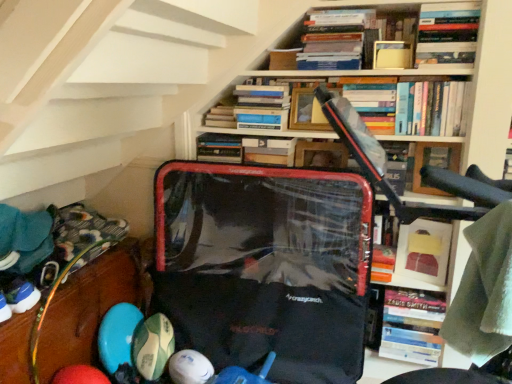
Question: Considering the relative sizes of hardcover book at center, which is the 1th book from bottom to top, and white rubber ball at lower center, positioned as the 1th toy in right-to-left order, in the image provided, is hardcover book at center, which is the 1th book from bottom to top, smaller than white rubber ball at lower center, positioned as the 1th toy in right-to-left order,?

Choices:
 (A) no
 (B) yes

Answer: (A)

Question: Are hardcover book at center, which is the 1th book from bottom to top, and white rubber ball at lower center, which is the second toy in left-to-right order, far apart?

Choices:
 (A) no
 (B) yes

Answer: (A)

Question: Is hardcover book at center, which is the seventh book in top-to-bottom order, to the left of white rubber ball at lower center, positioned as the 1th toy in right-to-left order, from the viewer's perspective?

Choices:
 (A) no
 (B) yes

Answer: (A)

Question: From the image's perspective, is hardcover book at center, which is the seventh book in top-to-bottom order, on white rubber ball at lower center, which is the second toy in left-to-right order?

Choices:
 (A) yes
 (B) no

Answer: (A)

Question: Is white rubber ball at lower center, which is the second toy in left-to-right order, inside hardcover book at center, which is the seventh book in top-to-bottom order?

Choices:
 (A) no
 (B) yes

Answer: (A)

Question: From a real-world perspective, is hardcover book at center, which is the 1th book from bottom to top, beneath white rubber ball at lower center, positioned as the 1th toy in right-to-left order?

Choices:
 (A) yes
 (B) no

Answer: (B)

Question: Is hardcover books at upper right, acting as the 5th book starting from the top, to the left of hardcover book at upper center, the 1th book when ordered from top to bottom, from the viewer's perspective?

Choices:
 (A) no
 (B) yes

Answer: (A)

Question: Considering the relative sizes of hardcover books at upper right, acting as the 5th book starting from the top, and hardcover book at upper center, placed as the seventh book when sorted from bottom to top, in the image provided, is hardcover books at upper right, acting as the 5th book starting from the top, wider than hardcover book at upper center, placed as the seventh book when sorted from bottom to top,?

Choices:
 (A) yes
 (B) no

Answer: (B)

Question: Is hardcover books at upper right, which appears as the 3th book when ordered from the bottom, oriented towards hardcover book at upper center, placed as the seventh book when sorted from bottom to top?

Choices:
 (A) yes
 (B) no

Answer: (B)

Question: From the image's perspective, is hardcover books at upper right, acting as the 5th book starting from the top, below hardcover book at upper center, placed as the seventh book when sorted from bottom to top?

Choices:
 (A) yes
 (B) no

Answer: (A)

Question: Is hardcover books at upper right, acting as the 5th book starting from the top, far from hardcover book at upper center, placed as the seventh book when sorted from bottom to top?

Choices:
 (A) no
 (B) yes

Answer: (A)

Question: Does hardcover books at upper right, acting as the 5th book starting from the top, come in front of hardcover book at upper center, placed as the seventh book when sorted from bottom to top?

Choices:
 (A) no
 (B) yes

Answer: (B)

Question: Does matte yellow book at upper center, which is the third book from top to bottom, lie in front of green rubber ball at lower left, arranged as the second toy when viewed from the right?

Choices:
 (A) yes
 (B) no

Answer: (A)